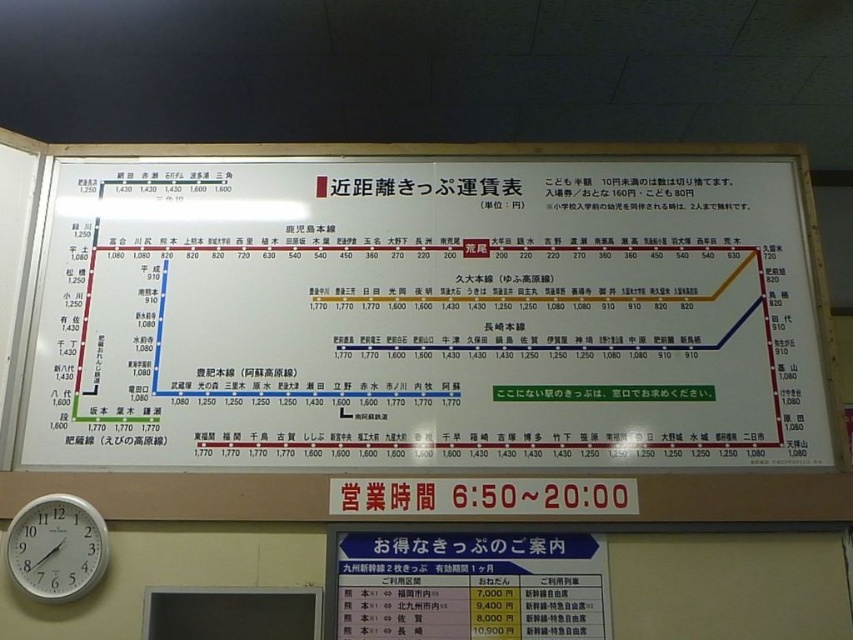
Does matte plastic signboard at center have a larger size compared to white plastic clock at lower left?

Yes, matte plastic signboard at center is bigger than white plastic clock at lower left.

Who is taller, matte plastic signboard at center or white plastic clock at lower left?

Standing taller between the two is white plastic clock at lower left.

What are the coordinates of `matte plastic signboard at center` in the screenshot? It's located at (468, 586).

Which is above, white paper at center or matte plastic signboard at center?

white paper at center

Is white paper at center bigger than matte plastic signboard at center?

Yes.

This screenshot has height=640, width=853. Describe the element at coordinates (427, 314) in the screenshot. I see `white paper at center` at that location.

You are a GUI agent. You are given a task and a screenshot of the screen. Output one action in this format:
    pyautogui.click(x=<x>, y=<y>)
    Task: Click on the white paper at center
    
    Given the screenshot: What is the action you would take?
    pyautogui.click(x=427, y=314)

Is white paper at center positioned in front of white plastic clock at lower left?

No, it is behind white plastic clock at lower left.

Between point (148, 456) and point (38, 529), which one is positioned behind?

The point (148, 456) is behind.

Locate an element on the screen. white paper at center is located at coordinates (427, 314).